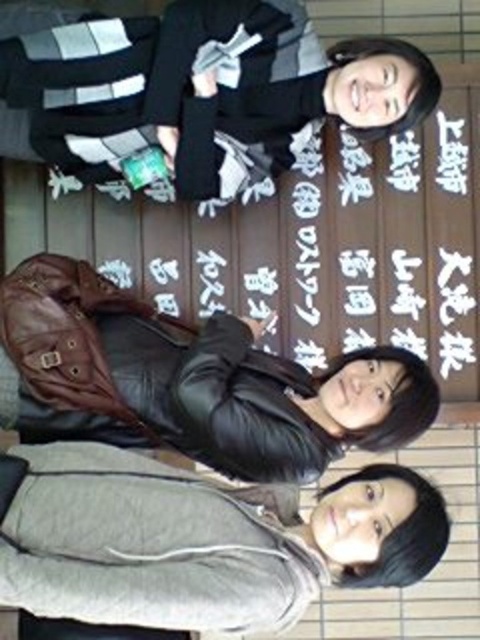
Question: Which of the following is the closest to the observer?

Choices:
 (A) gray fleece jacket at lower right
 (B) black leather jacket at upper center
 (C) black leather jacket at center

Answer: (A)

Question: Estimate the real-world distances between objects in this image. Which object is closer to the gray fleece jacket at lower right?

Choices:
 (A) black leather jacket at upper center
 (B) black leather jacket at center

Answer: (B)

Question: Is black leather jacket at upper center smaller than gray fleece jacket at lower right?

Choices:
 (A) yes
 (B) no

Answer: (B)

Question: Does black leather jacket at upper center have a larger size compared to gray fleece jacket at lower right?

Choices:
 (A) yes
 (B) no

Answer: (A)

Question: Can you confirm if black leather jacket at upper center is wider than gray fleece jacket at lower right?

Choices:
 (A) yes
 (B) no

Answer: (A)

Question: Which is nearer to the black leather jacket at center?

Choices:
 (A) gray fleece jacket at lower right
 (B) black leather jacket at upper center

Answer: (A)